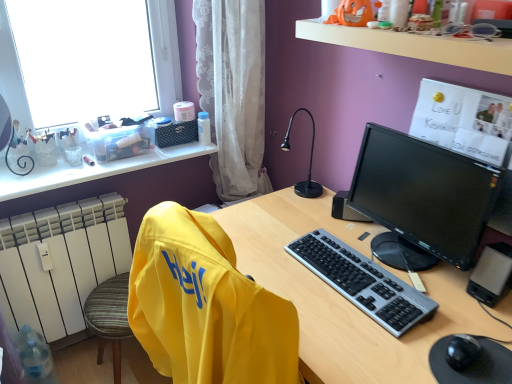
Question: Is the depth of white lace curtain at center greater than that of yellow fabric swivel chair at left?

Choices:
 (A) yes
 (B) no

Answer: (A)

Question: Is white lace curtain at center directly adjacent to yellow fabric swivel chair at left?

Choices:
 (A) no
 (B) yes

Answer: (A)

Question: Is white lace curtain at center positioned far away from yellow fabric swivel chair at left?

Choices:
 (A) no
 (B) yes

Answer: (A)

Question: Is yellow fabric swivel chair at left inside white lace curtain at center?

Choices:
 (A) no
 (B) yes

Answer: (A)

Question: Does white lace curtain at center have a lesser width compared to yellow fabric swivel chair at left?

Choices:
 (A) no
 (B) yes

Answer: (B)

Question: From their relative heights in the image, would you say matte plastic desk at center is taller or shorter than white lace curtain at center?

Choices:
 (A) tall
 (B) short

Answer: (B)

Question: In the image, is matte plastic desk at center on the left side or the right side of white lace curtain at center?

Choices:
 (A) right
 (B) left

Answer: (A)

Question: Is matte plastic desk at center in front of or behind white lace curtain at center in the image?

Choices:
 (A) behind
 (B) front

Answer: (B)

Question: Is matte plastic desk at center situated inside white lace curtain at center or outside?

Choices:
 (A) inside
 (B) outside

Answer: (B)

Question: From their relative heights in the image, would you say black plastic keyboard at center is taller or shorter than white lace curtain at center?

Choices:
 (A) tall
 (B) short

Answer: (B)

Question: Is black plastic keyboard at center in front of or behind white lace curtain at center in the image?

Choices:
 (A) behind
 (B) front

Answer: (B)

Question: From the image's perspective, is black plastic keyboard at center located above or below white lace curtain at center?

Choices:
 (A) below
 (B) above

Answer: (A)

Question: Which is correct: black plastic keyboard at center is inside white lace curtain at center, or outside of it?

Choices:
 (A) outside
 (B) inside

Answer: (A)

Question: Is white plastic window sill at upper center in front of or behind white lace curtain at center in the image?

Choices:
 (A) front
 (B) behind

Answer: (A)

Question: Based on their positions, is white plastic window sill at upper center located to the left or right of white lace curtain at center?

Choices:
 (A) right
 (B) left

Answer: (A)